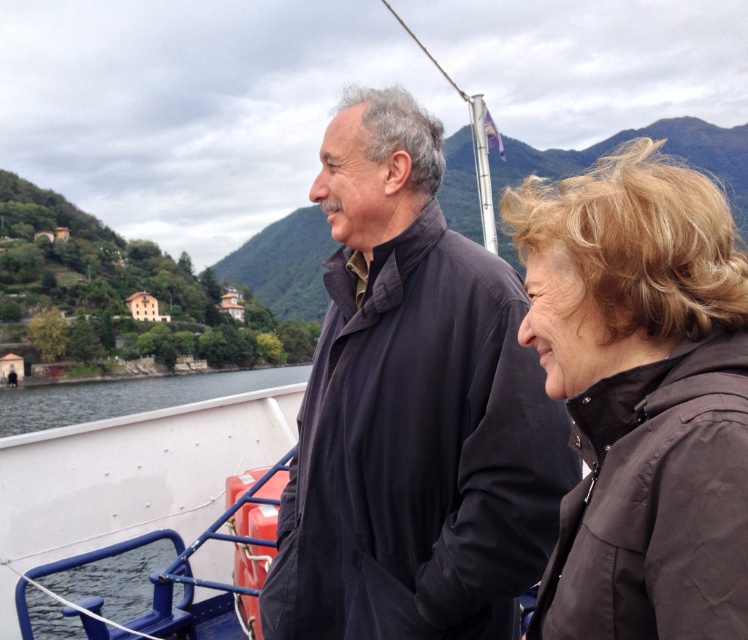
Image resolution: width=748 pixels, height=640 pixels. Describe the element at coordinates (411, 410) in the screenshot. I see `dark matte jacket at center` at that location.

Find the location of a particular element. dark matte jacket at center is located at coordinates (411, 410).

Is point (527, 362) positioned in front of point (573, 224)?

That is False.

The image size is (748, 640). Identify the location of dark matte jacket at center. (411, 410).

Which of these two, brown matte jacket at right or white smooth water at lower left, stands taller?

Standing taller between the two is brown matte jacket at right.

Is brown matte jacket at right bigger than white smooth water at lower left?

Incorrect, brown matte jacket at right is not larger than white smooth water at lower left.

Is point (616, 634) closer to camera compared to point (129, 380)?

Yes.

Identify the location of brown matte jacket at right. This screenshot has height=640, width=748. (640, 396).

Does brown matte jacket at right appear over white matte boat at center?

Yes, brown matte jacket at right is above white matte boat at center.

Is point (616, 634) positioned in front of point (96, 428)?

Yes, point (616, 634) is in front of point (96, 428).

Identify the location of brown matte jacket at right. (640, 396).

This screenshot has width=748, height=640. Identify the location of brown matte jacket at right. (640, 396).